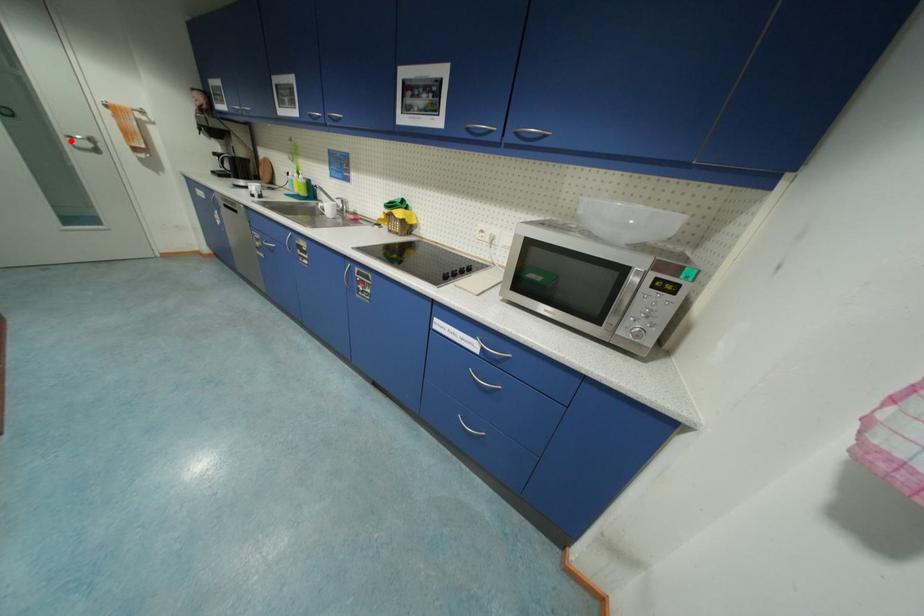
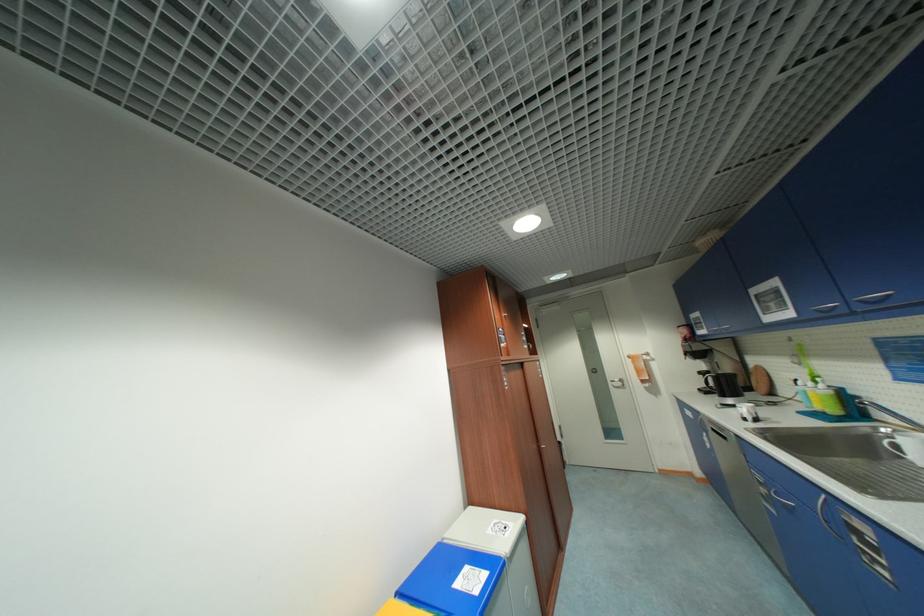
Find the pixel in the second image that matches the highlighted location in the first image.

(615, 384)